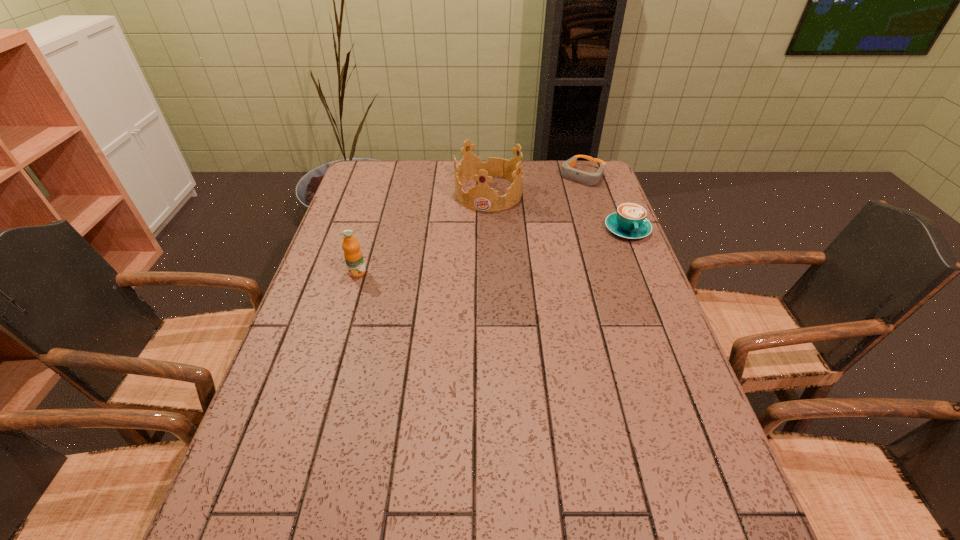
Find the location of a particular element. Image resolution: width=960 pixels, height=540 pixels. blank region between the third tallest object and the orange juice is located at coordinates (492, 251).

At what (x,y) coordinates should I click in order to perform the action: click on empty space between the cappuccino and the second object from left to right. Please return your answer as a coordinate pair (x, y). This screenshot has width=960, height=540. Looking at the image, I should click on (558, 211).

Identify the location of free space that is in between the leftmost object and the cappuccino. Image resolution: width=960 pixels, height=540 pixels. click(492, 251).

What are the coordinates of `vacant space that's between the shortest object and the second shortest object` in the screenshot? It's located at (605, 202).

At what (x,y) coordinates should I click in order to perform the action: click on free area in between the goggles and the leftmost object. Please return your answer as a coordinate pair (x, y). Image resolution: width=960 pixels, height=540 pixels. Looking at the image, I should click on (470, 225).

Identify which object is the closest to the leftmost object. Please provide its 2D coordinates. Your answer should be formatted as a tuple, i.e. [(x, y)], where the tuple contains the x and y coordinates of a point satisfying the conditions above.

[(481, 197)]

At what (x,y) coordinates should I click in order to perform the action: click on object that stands as the second closest to the shortest object. Please return your answer as a coordinate pair (x, y). Looking at the image, I should click on (630, 222).